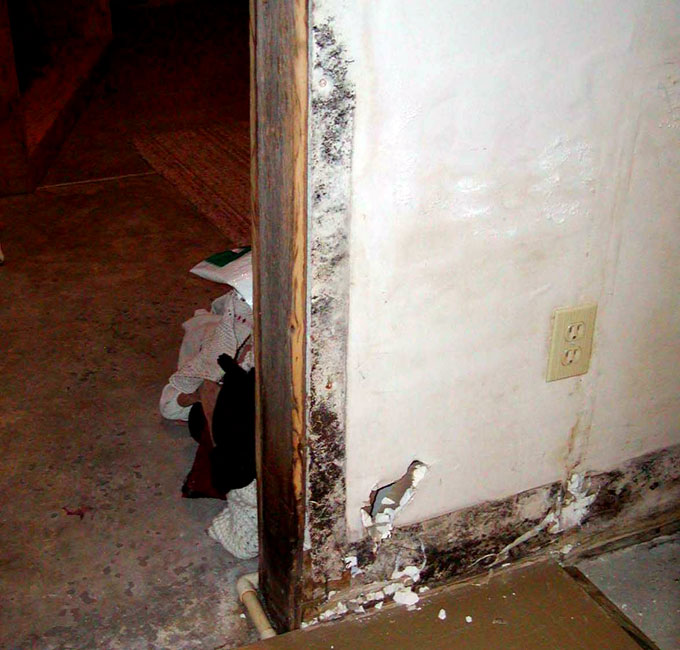
The width and height of the screenshot is (680, 650). In order to click on white wall in this screenshot , I will do `click(486, 210)`.